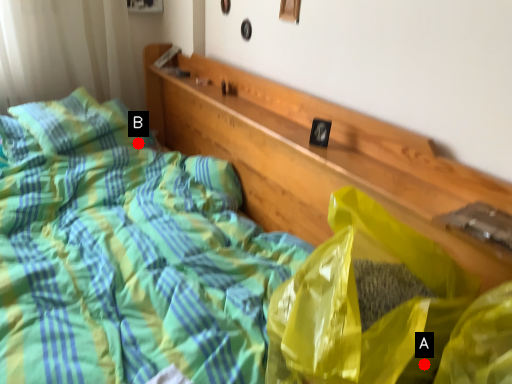
Question: Two points are circled on the image, labeled by A and B beside each circle. Which point is further to the camera?

Choices:
 (A) A is further
 (B) B is further

Answer: (B)